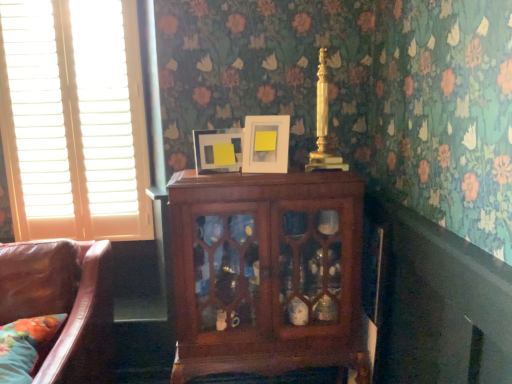
Locate an element on the screen. This screenshot has height=384, width=512. vacant space in front of matte white picture frame at center, the first picture frame when ordered from left to right is located at coordinates (218, 182).